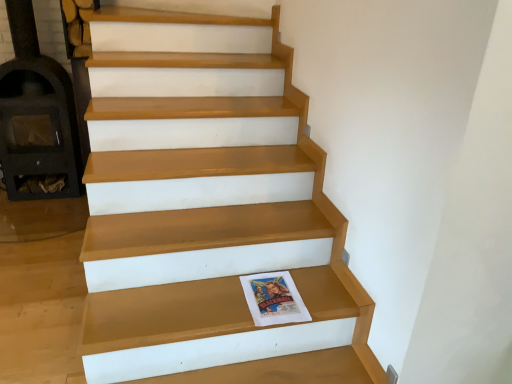
What do you see at coordinates (36, 114) in the screenshot?
I see `black matte fireplace at left` at bounding box center [36, 114].

Where is `black matte fireplace at left`? The image size is (512, 384). black matte fireplace at left is located at coordinates (36, 114).

Find the location of a particular element. Image resolution: width=512 pixels, height=384 pixels. black matte fireplace at left is located at coordinates (36, 114).